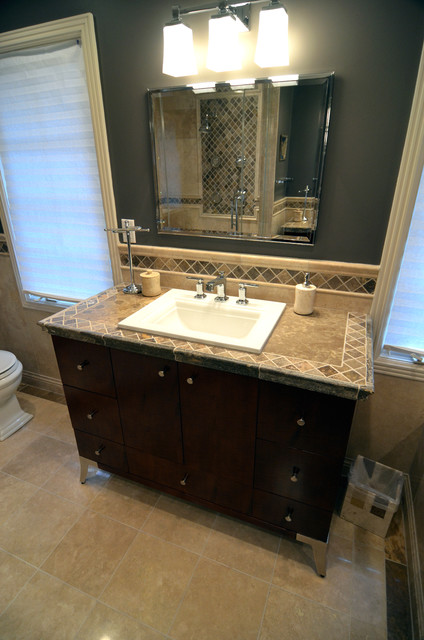
The height and width of the screenshot is (640, 424). I want to click on countertop, so click(x=100, y=310).